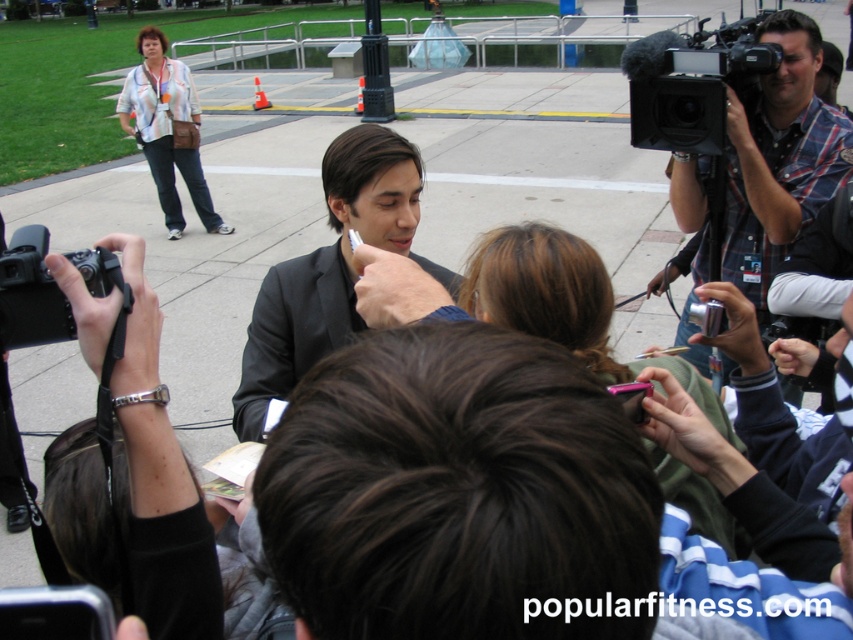
Is black plastic video camera at upper right wider than blue fabric shirt at center?

No, black plastic video camera at upper right is not wider than blue fabric shirt at center.

Is black plastic video camera at upper right thinner than blue fabric shirt at center?

Yes, black plastic video camera at upper right is thinner than blue fabric shirt at center.

Between point (747, 45) and point (525, 600), which one is positioned in front?

Point (525, 600) is in front.

At what (x,y) coordinates should I click in order to perform the action: click on black plastic video camera at upper right. Please return your answer as a coordinate pair (x, y). The image size is (853, 640). Looking at the image, I should click on (689, 83).

Which is below, plaid shirt at center or striped shirt at upper left?

plaid shirt at center is below.

Is plaid shirt at center taller than striped shirt at upper left?

Correct, plaid shirt at center is much taller as striped shirt at upper left.

Who is more forward, (706,352) or (196,196)?

Positioned in front is point (706,352).

You are a GUI agent. You are given a task and a screenshot of the screen. Output one action in this format:
    pyautogui.click(x=<x>, y=<y>)
    Task: Click on the plaid shirt at center
    The width and height of the screenshot is (853, 640).
    Given the screenshot: What is the action you would take?
    pyautogui.click(x=778, y=156)

Can you confirm if plaid shirt at center is taller than black plastic camera at lower left?

Indeed, plaid shirt at center has a greater height compared to black plastic camera at lower left.

Can you confirm if plaid shirt at center is positioned to the left of black plastic camera at lower left?

In fact, plaid shirt at center is to the right of black plastic camera at lower left.

Between point (761, 131) and point (33, 268), which one is positioned in front?

Point (33, 268) is more forward.

At what (x,y) coordinates should I click in order to perform the action: click on plaid shirt at center. Please return your answer as a coordinate pair (x, y). Looking at the image, I should click on (778, 156).